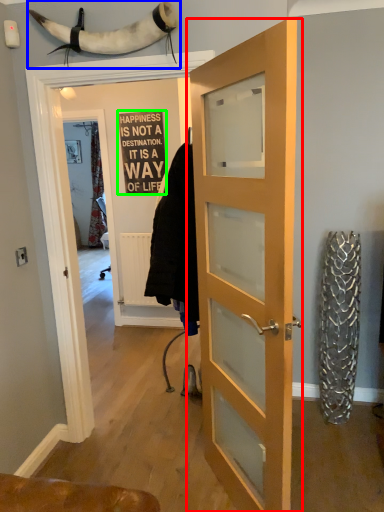
Question: Considering the real-world distances, which object is closest to door (highlighted by a red box)? animal (highlighted by a blue box) or writing (highlighted by a green box).

Choices:
 (A) animal
 (B) writing

Answer: (A)